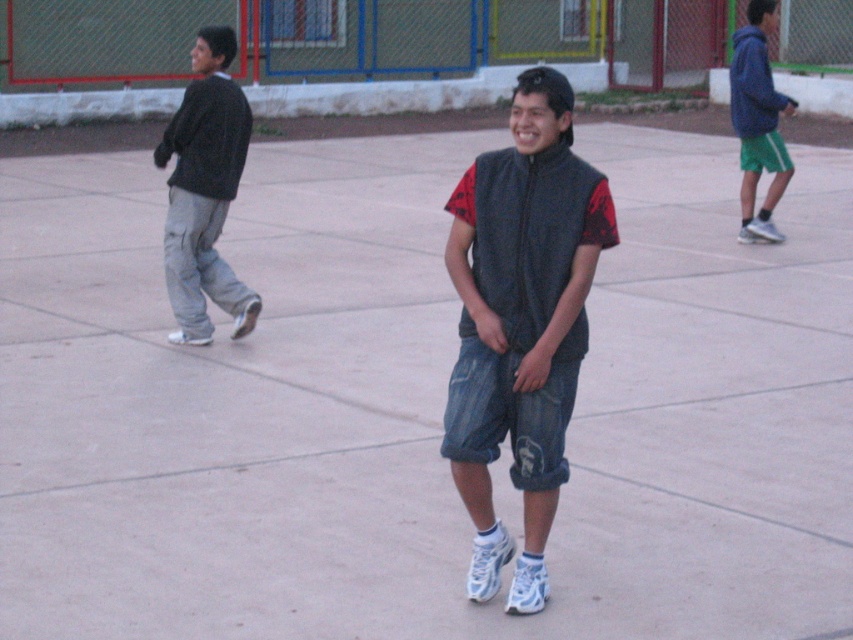
Based on the scene description, can you determine the spatial relationship between the denim shorts at center and the dark gray sweater at left?

The denim shorts at center is located below the dark gray sweater at left, meaning it is positioned lower in the image compared to the sweater.

You are standing at the back of the image and want to greet the person wearing the dark gray sweater at left. Which direction should you move to first to avoid blocking the view of the denim shorts at center?

You should move to the side away from the denim shorts at center since the denim shorts at center is in front of the dark gray sweater at left, meaning the dark gray sweater at left is behind it. Moving sideways away from the denim shorts at center would allow you to reach the dark gray sweater at left without obstructing the view of the central figure.